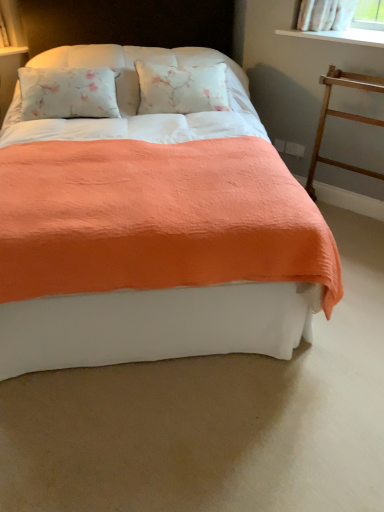
Question: From a real-world perspective, is white smooth window sill at upper right beneath wooden at right?

Choices:
 (A) no
 (B) yes

Answer: (A)

Question: Does white smooth window sill at upper right lie behind wooden at right?

Choices:
 (A) yes
 (B) no

Answer: (A)

Question: From the image's perspective, is white smooth window sill at upper right located above wooden at right?

Choices:
 (A) yes
 (B) no

Answer: (A)

Question: Is white smooth window sill at upper right outside of wooden at right?

Choices:
 (A) no
 (B) yes

Answer: (B)

Question: From the image's perspective, would you say white smooth window sill at upper right is shown under wooden at right?

Choices:
 (A) no
 (B) yes

Answer: (A)

Question: From a real-world perspective, is white smooth window sill at upper right on top of wooden at right?

Choices:
 (A) yes
 (B) no

Answer: (A)

Question: From the image's perspective, is white smooth window sill at upper right located above coral fabric bed at center?

Choices:
 (A) yes
 (B) no

Answer: (A)

Question: Is white smooth window sill at upper right to the left of coral fabric bed at center from the viewer's perspective?

Choices:
 (A) yes
 (B) no

Answer: (B)

Question: Considering the relative sizes of white smooth window sill at upper right and coral fabric bed at center in the image provided, is white smooth window sill at upper right bigger than coral fabric bed at center?

Choices:
 (A) no
 (B) yes

Answer: (A)

Question: Is white smooth window sill at upper right positioned with its back to coral fabric bed at center?

Choices:
 (A) yes
 (B) no

Answer: (B)

Question: Is white smooth window sill at upper right taller than coral fabric bed at center?

Choices:
 (A) yes
 (B) no

Answer: (B)

Question: Is white smooth window sill at upper right to the right of coral fabric bed at center from the viewer's perspective?

Choices:
 (A) yes
 (B) no

Answer: (A)

Question: From a real-world perspective, is wooden at right under coral fabric bed at center?

Choices:
 (A) no
 (B) yes

Answer: (B)